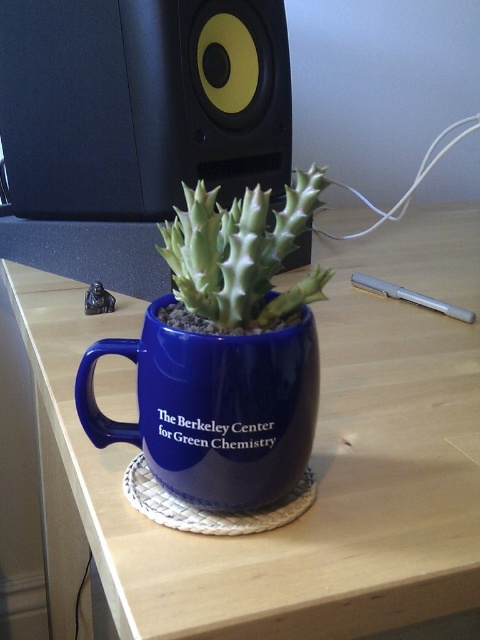
Question: Is wooden table at center to the right of blue ceramic mug at center from the viewer's perspective?

Choices:
 (A) no
 (B) yes

Answer: (B)

Question: Which object appears farthest from the camera in this image?

Choices:
 (A) green spiky succulent at center
 (B) blue ceramic mug at center
 (C) wooden table at center

Answer: (B)

Question: Is black matte speaker at upper left to the right of green spiky succulent at center from the viewer's perspective?

Choices:
 (A) yes
 (B) no

Answer: (B)

Question: Does wooden table at center come in front of black matte speaker at upper left?

Choices:
 (A) yes
 (B) no

Answer: (A)

Question: Which object appears farthest from the camera in this image?

Choices:
 (A) green spiky succulent at center
 (B) black matte speaker at upper left
 (C) blue ceramic mug at center
 (D) wooden table at center

Answer: (B)

Question: Which point is closer to the camera?

Choices:
 (A) (259, 433)
 (B) (16, 145)
 (C) (315, 275)

Answer: (A)